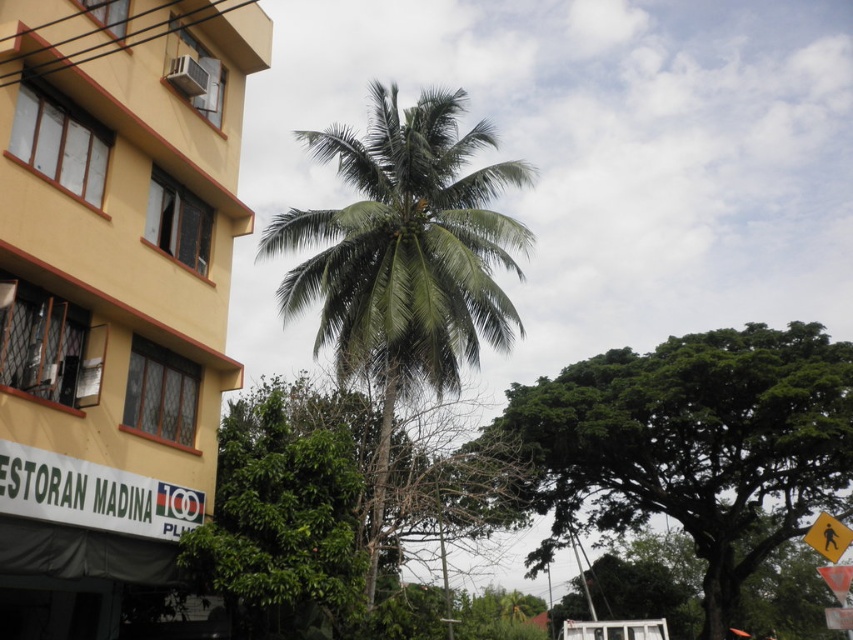
You are a city planner evaluating the space between the yellow matte building at left and the green leafy palm tree at center. Based on their sizes, which one would require more space for maintenance equipment access?

The green leafy palm tree at center requires more space for maintenance equipment access because it is larger in size than the yellow matte building at left.

You are standing at the center of the image. Which direction should you face to look directly at the green leafy palm tree at center?

The green leafy palm tree at center is already located at the center of the image, so facing forward would allow you to look directly at it.